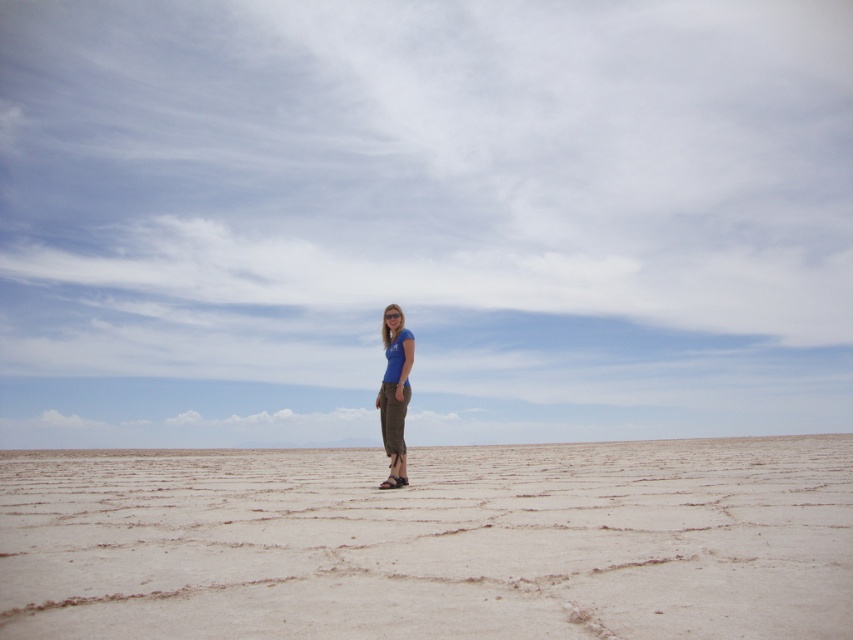
Is light brown sandy at center smaller than blue fabric pants at center?

Actually, light brown sandy at center might be larger than blue fabric pants at center.

Can you confirm if light brown sandy at center is positioned above blue fabric pants at center?

No, light brown sandy at center is not above blue fabric pants at center.

Where is `light brown sandy at center`? The image size is (853, 640). light brown sandy at center is located at coordinates (432, 541).